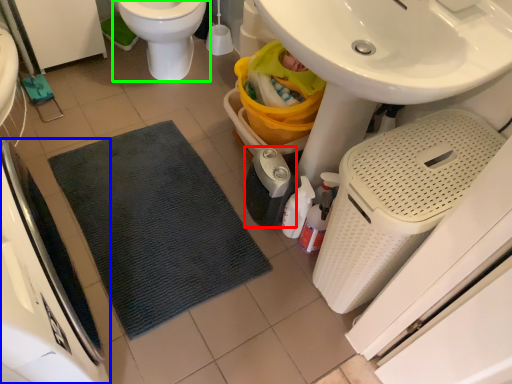
Question: Which is nearer to the appliance (highlighted by a red box)? appliance (highlighted by a blue box) or toilet (highlighted by a green box).

Choices:
 (A) appliance
 (B) toilet

Answer: (B)